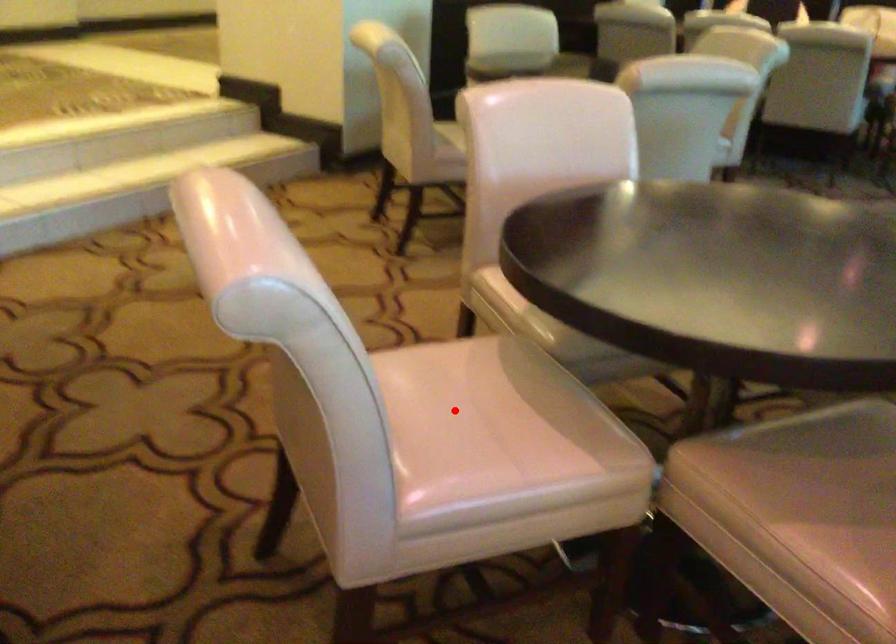
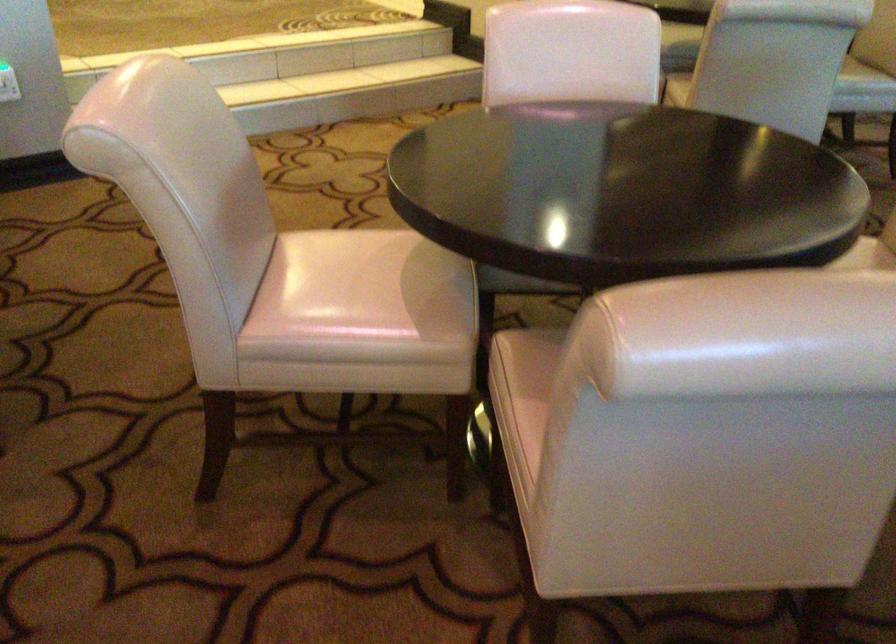
Question: I am providing you with two images of the same scene from different viewpoints. A red point is marked on the first image. At the location where the point appears in image 1, is it still visible in image 2?

Choices:
 (A) Yes
 (B) No

Answer: (A)